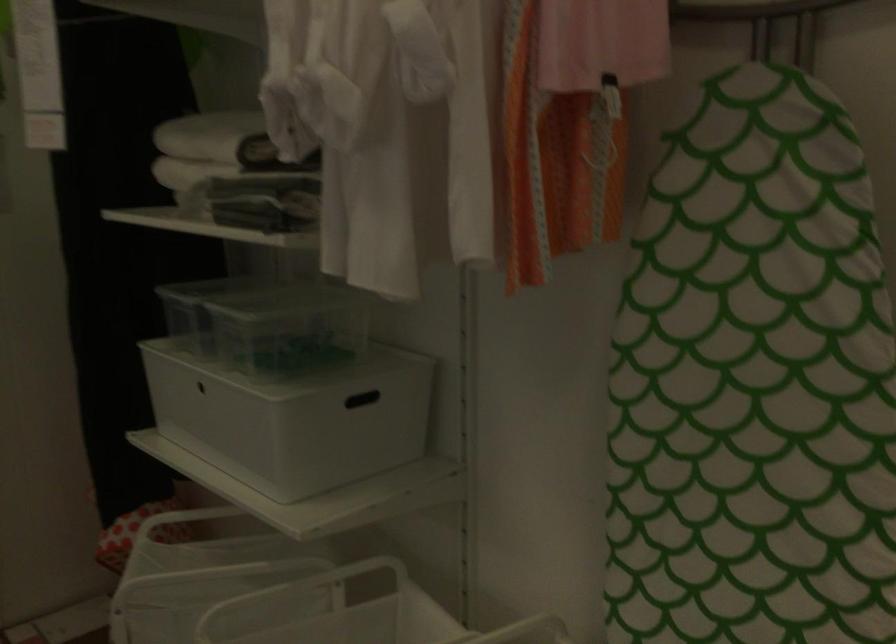
Identify the location of patterned ironing board. The image size is (896, 644). (754, 383).